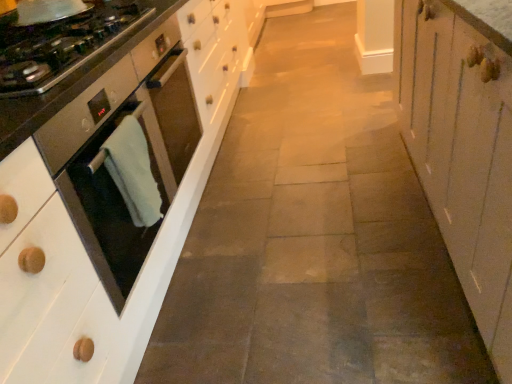
Where is `satin steel oven at left`? This screenshot has height=384, width=512. satin steel oven at left is located at coordinates (69, 85).

From a real-world perspective, who is located lower, satin steel oven at left or green towel at left?

satin steel oven at left, from a real-world perspective.

Image resolution: width=512 pixels, height=384 pixels. I want to click on material above the satin steel oven at left (from a real-world perspective), so click(x=133, y=171).

Based on their sizes in the image, would you say satin steel oven at left is bigger or smaller than green towel at left?

Considering their sizes, satin steel oven at left takes up more space than green towel at left.

From the image's perspective, relative to green towel at left, is satin steel oven at left above or below?

satin steel oven at left is situated higher than green towel at left in the image.

The width and height of the screenshot is (512, 384). I want to click on countertop below the green towel at left (from a real-world perspective), so click(x=69, y=85).

Are green towel at left and satin steel oven at left located far from each other?

No, green towel at left is in close proximity to satin steel oven at left.

From the picture: From the image's perspective, relative to satin steel oven at left, is green towel at left above or below?

green towel at left is situated lower than satin steel oven at left in the image.

In the scene shown: From a real-world perspective, is green towel at left positioned under satin steel oven at left based on gravity?

No, from a real-world perspective, green towel at left is not below satin steel oven at left.

Is satin steel oven at left facing away from satin black oven at left?

satin steel oven at left does not have its back to satin black oven at left.

From a real-world perspective, does satin steel oven at left stand above satin black oven at left?

Actually, satin steel oven at left is physically below satin black oven at left in the real world.

Are satin steel oven at left and satin black oven at left making contact?

satin steel oven at left and satin black oven at left are clearly separated.

In order to click on countertop on the right of the satin black oven at left in this screenshot , I will do `click(69, 85)`.

What's the angular difference between green towel at left and white wood cabinet at right's facing directions?

green towel at left and white wood cabinet at right are facing 98.1 degrees away from each other.

Does point (110, 144) lie behind point (405, 63)?

No, (110, 144) is in front of (405, 63).

Consider the image. Considering the relative sizes of green towel at left and white wood cabinet at right in the image provided, is green towel at left shorter than white wood cabinet at right?

Yes, green towel at left is shorter than white wood cabinet at right.

Between green towel at left and white wood cabinet at right, which one appears on the left side from the viewer's perspective?

Positioned to the left is green towel at left.

Is green towel at left far from satin black oven at left?

No, there isn't a large distance between green towel at left and satin black oven at left.

Where is `home appliance to the left of green towel at left`? Image resolution: width=512 pixels, height=384 pixels. home appliance to the left of green towel at left is located at coordinates pos(106,175).

From a real-world perspective, is green towel at left beneath satin black oven at left?

No, from a real-world perspective, green towel at left is not beneath satin black oven at left.

Can white wood cabinet at right be found inside satin black oven at left?

No, white wood cabinet at right is not a part of satin black oven at left.

Who is smaller, satin black oven at left or white wood cabinet at right?

satin black oven at left is smaller.

Measure the distance from satin black oven at left to white wood cabinet at right.

The distance of satin black oven at left from white wood cabinet at right is 3.31 feet.

From the image's perspective, between satin black oven at left and white wood cabinet at right, which one is located above?

white wood cabinet at right, from the image's perspective.

Is satin black oven at left not near green towel at left?

No.

You are a GUI agent. You are given a task and a screenshot of the screen. Output one action in this format:
    pyautogui.click(x=<x>, y=<y>)
    Task: Click on the home appliance to the left of green towel at left
    
    Given the screenshot: What is the action you would take?
    pyautogui.click(x=106, y=175)

Considering the sizes of objects satin black oven at left and green towel at left in the image provided, who is smaller, satin black oven at left or green towel at left?

green towel at left is smaller.

From the image's perspective, is satin black oven at left located above or below green towel at left?

Based on their image positions, satin black oven at left is located beneath green towel at left.

Find the location of a particular element. The width and height of the screenshot is (512, 384). material in front of the satin steel oven at left is located at coordinates (133, 171).

At what (x,y) coordinates should I click in order to perform the action: click on material that is below the satin steel oven at left (from the image's perspective). Please return your answer as a coordinate pair (x, y). Looking at the image, I should click on (133, 171).

Looking at the image, which one is located closer to satin steel oven at left, satin black oven at left or green towel at left?

satin black oven at left is closer to satin steel oven at left.

From the image, which object appears to be farther from satin black oven at left, satin steel oven at left or white wood cabinet at right?

Based on the image, white wood cabinet at right appears to be further to satin black oven at left.

Based on their spatial positions, is satin steel oven at left or green towel at left further from satin black oven at left?

satin steel oven at left is further to satin black oven at left.

Based on their spatial positions, is green towel at left or satin steel oven at left closer to satin black oven at left?

green towel at left.

Considering their positions, is satin black oven at left positioned closer to white wood cabinet at right than green towel at left?

Among the two, green towel at left is located nearer to white wood cabinet at right.

Estimate the real-world distances between objects in this image. Which object is closer to satin steel oven at left, satin black oven at left or white wood cabinet at right?

satin black oven at left lies closer to satin steel oven at left than the other object.

Which object lies further to the anchor point white wood cabinet at right, satin steel oven at left or green towel at left?

satin steel oven at left is positioned further to the anchor white wood cabinet at right.

Considering their positions, is satin black oven at left positioned further to green towel at left than white wood cabinet at right?

Based on the image, white wood cabinet at right appears to be further to green towel at left.

What are the coordinates of `material between satin black oven at left and white wood cabinet at right from left to right` in the screenshot? It's located at (133, 171).

Where is `countertop located between satin black oven at left and white wood cabinet at right in the left-right direction`? This screenshot has height=384, width=512. countertop located between satin black oven at left and white wood cabinet at right in the left-right direction is located at coordinates (69, 85).

Image resolution: width=512 pixels, height=384 pixels. Find the location of `material situated between satin steel oven at left and white wood cabinet at right from left to right`. material situated between satin steel oven at left and white wood cabinet at right from left to right is located at coordinates (133, 171).

You are a GUI agent. You are given a task and a screenshot of the screen. Output one action in this format:
    pyautogui.click(x=<x>, y=<y>)
    Task: Click on the material located between satin black oven at left and satin steel oven at left in the depth direction
    The width and height of the screenshot is (512, 384).
    Given the screenshot: What is the action you would take?
    pyautogui.click(x=133, y=171)